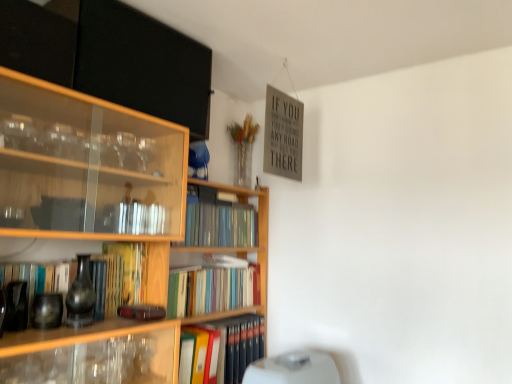
Question: Considering the relative positions of hardcover book at center, placed as the 3th book when sorted from top to bottom, and hardcover books at center, placed as the 4th book when sorted from bottom to top, in the image provided, is hardcover book at center, placed as the 3th book when sorted from top to bottom, to the left or to the right of hardcover books at center, placed as the 4th book when sorted from bottom to top,?

Choices:
 (A) right
 (B) left

Answer: (A)

Question: Is hardcover book at center, the 2th book positioned from the bottom, bigger or smaller than hardcover books at center, placed as the 4th book when sorted from bottom to top?

Choices:
 (A) small
 (B) big

Answer: (A)

Question: Which is farther from the hardcover books at center, the 1th book when ordered from top to bottom?

Choices:
 (A) hardcover book at center, marked as the first book in a bottom-to-top arrangement
 (B) white plastic water heater at lower center
 (C) matte black book at left, the 3th book from the bottom
 (D) hardcover book at center, placed as the 3th book when sorted from top to bottom
 (E) wooden bookcase at center

Answer: (B)

Question: Which object is positioned farthest from the hardcover book at center, the 2th book positioned from the bottom?

Choices:
 (A) white plastic water heater at lower center
 (B) wooden bookcase at center
 (C) matte black book at left, the 3th book from the bottom
 (D) hardcover books at center, the 1th book when ordered from top to bottom
 (E) hardcover book at center, marked as the first book in a bottom-to-top arrangement

Answer: (A)